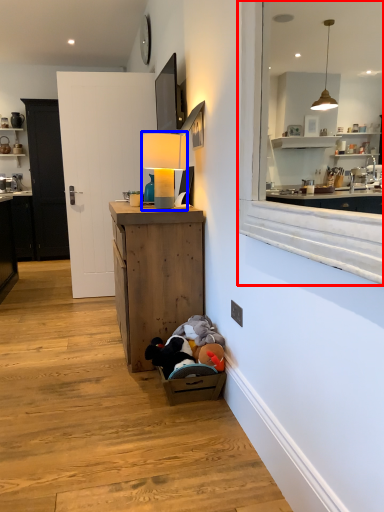
Question: Which of the following is the farthest to the observer, window (highlighted by a red box) or table lamp (highlighted by a blue box)?

Choices:
 (A) window
 (B) table lamp

Answer: (B)